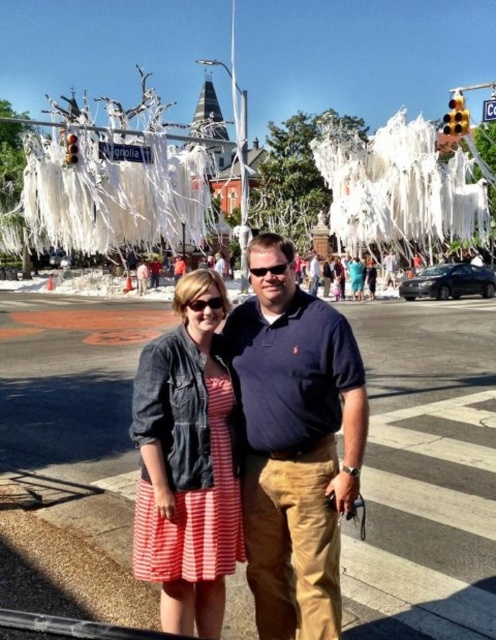
You are a photographer trying to capture a candid shot of both the dark blue cotton polo shirt at center and the striped cotton dress at center. Since you want to ensure both subjects are fully visible in the frame, which one should you focus on first to avoid cropping either?

The dark blue cotton polo shirt at center is much taller than the striped cotton dress at center. To ensure both are fully visible, focus on the dark blue cotton polo shirt at center first as it is taller and requires more vertical space in the frame.

You are a photographer trying to capture the two people in the scene. You want to frame the striped cotton dress at center and the dark blue cotton polo shirt at center in your shot. Which one should you focus on first if you want to include both in the frame without moving the camera?

The striped cotton dress at center is on the left side, so you should focus on it first to ensure both the striped cotton dress at center and the dark blue cotton polo shirt at center fit in the frame.

You are a photographer trying to capture the dark blue cotton polo shirt at center in the scene. Based on the coordinates provided, where should you aim your camera to ensure the subject is centered in your shot?

The dark blue cotton polo shirt at center is located at coordinates point (295, 442), so aim your camera there to center it.